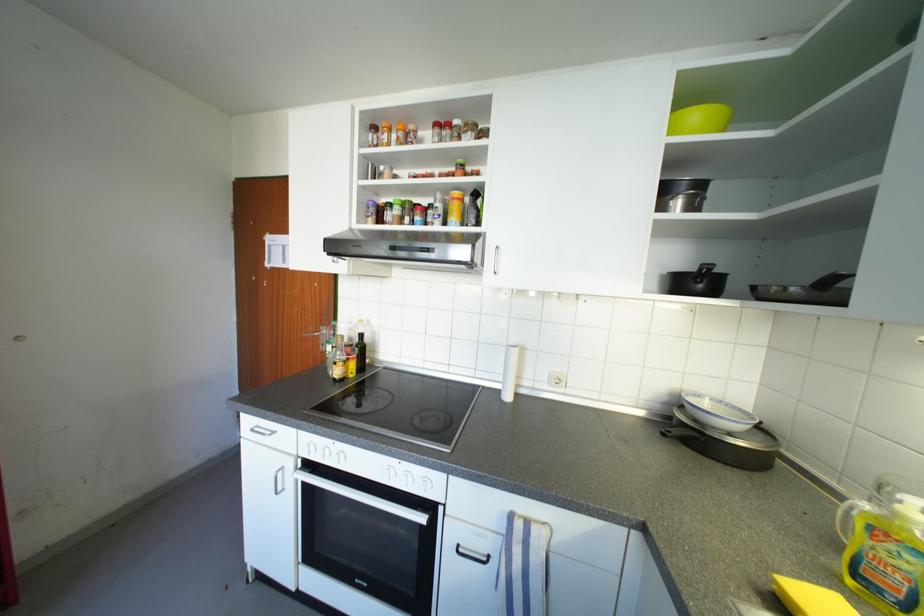
This screenshot has width=924, height=616. What do you see at coordinates (831, 280) in the screenshot?
I see `the frying pan handle` at bounding box center [831, 280].